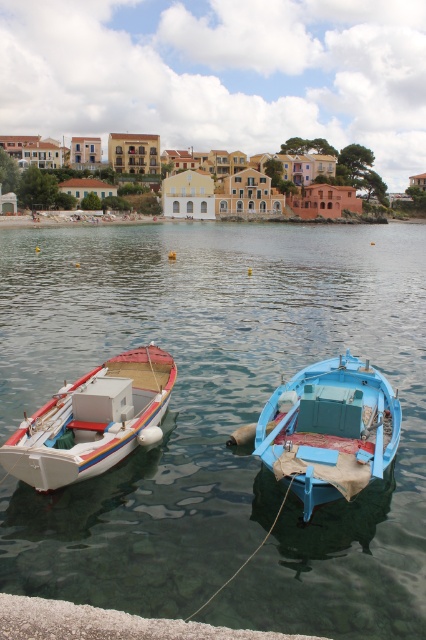
Question: Does blue painted wood boat at center come behind white matte boat at left?

Choices:
 (A) no
 (B) yes

Answer: (A)

Question: Does blue painted wood boat at center have a greater width compared to white matte boat at left?

Choices:
 (A) no
 (B) yes

Answer: (A)

Question: Which object appears closest to the camera in this image?

Choices:
 (A) white matte boat at left
 (B) clear water at center

Answer: (B)

Question: Which point is farther from the camera taking this photo?

Choices:
 (A) [x=120, y=385]
 (B) [x=216, y=396]

Answer: (B)

Question: Is clear water at center to the left of blue painted wood boat at center from the viewer's perspective?

Choices:
 (A) yes
 (B) no

Answer: (A)

Question: Which object appears farthest from the camera in this image?

Choices:
 (A) blue painted wood boat at center
 (B) white matte boat at left
 (C) clear water at center

Answer: (B)